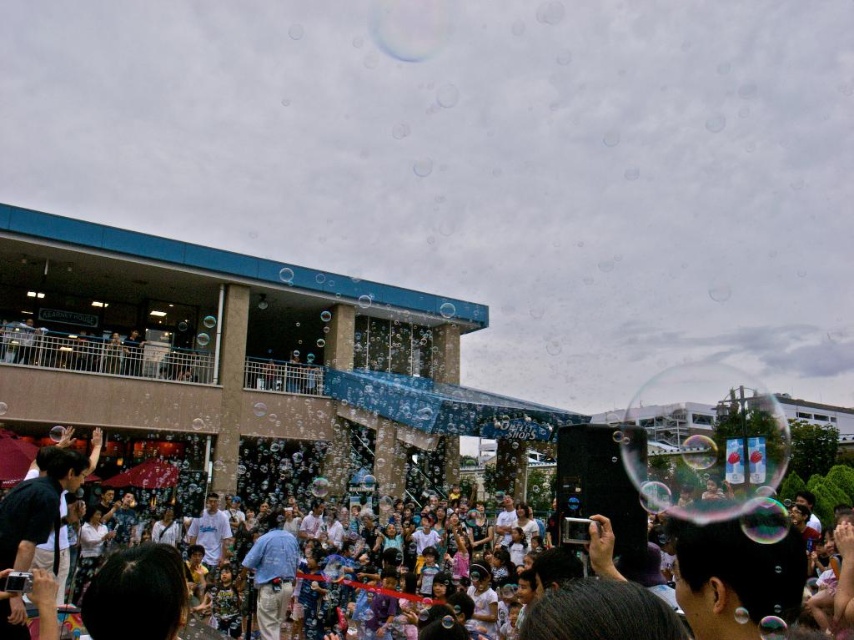
Is white cotton shirt at center wider than blue denim jeans at center?

Yes, white cotton shirt at center is wider than blue denim jeans at center.

This screenshot has width=854, height=640. What do you see at coordinates (681, 586) in the screenshot? I see `white cotton shirt at center` at bounding box center [681, 586].

This screenshot has width=854, height=640. Find the location of `white cotton shirt at center`. white cotton shirt at center is located at coordinates (681, 586).